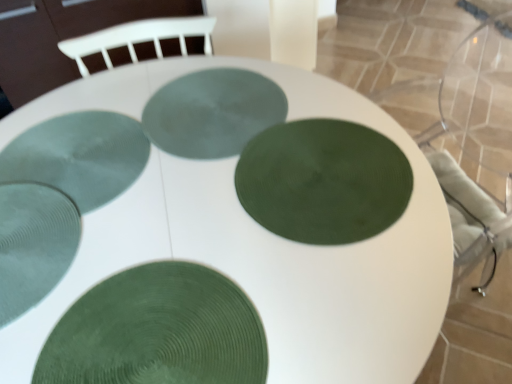
Identify the location of free space that is in between green textured glass plate at center, arranged as the fourth glass plate when viewed from the front, and clear textured glass at bottom left, the fourth glass plate from the back. (112, 223).